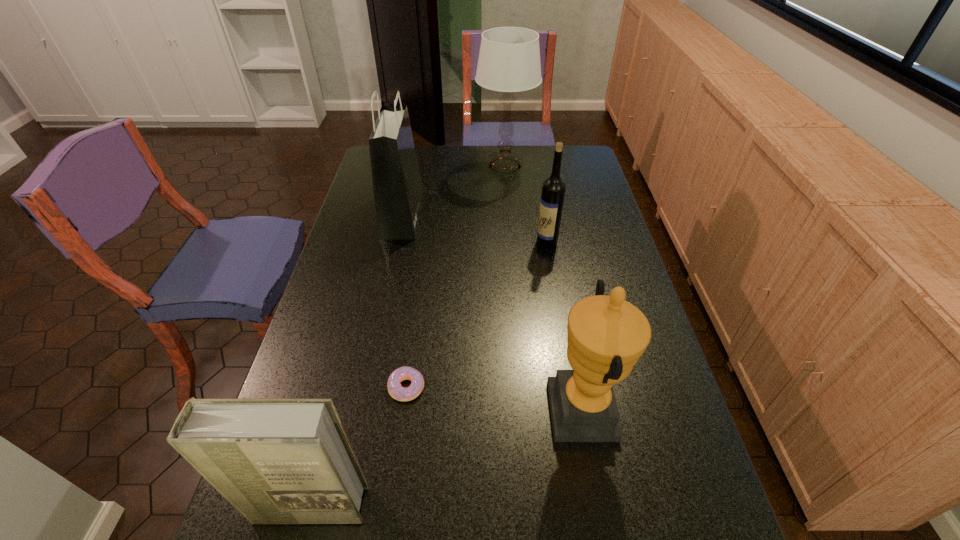
This screenshot has height=540, width=960. In order to click on object located at the right edge in this screenshot , I will do `click(606, 335)`.

Find the location of a particular element. vacant space at the left edge is located at coordinates (305, 373).

I want to click on vacant region at the right edge of the desktop, so click(x=588, y=185).

Image resolution: width=960 pixels, height=540 pixels. What are the coordinates of `free region at the far right corner of the desktop` in the screenshot? It's located at (586, 145).

This screenshot has width=960, height=540. Find the location of `empty space that is in between the award and the wine bottle`. empty space that is in between the award and the wine bottle is located at coordinates (564, 326).

Locate an element on the screen. The height and width of the screenshot is (540, 960). free space between the wine bottle and the shopping bag is located at coordinates (474, 228).

The height and width of the screenshot is (540, 960). In order to click on free space between the farthest object and the nearest object in this screenshot , I will do `click(407, 335)`.

In order to click on free spot between the shopping bag and the farthest object in this screenshot , I will do `click(453, 190)`.

The height and width of the screenshot is (540, 960). What are the coordinates of `vacant area between the farthest object and the award` in the screenshot? It's located at (544, 288).

What are the coordinates of `free space between the shopping bag and the shortest object` in the screenshot? It's located at (404, 301).